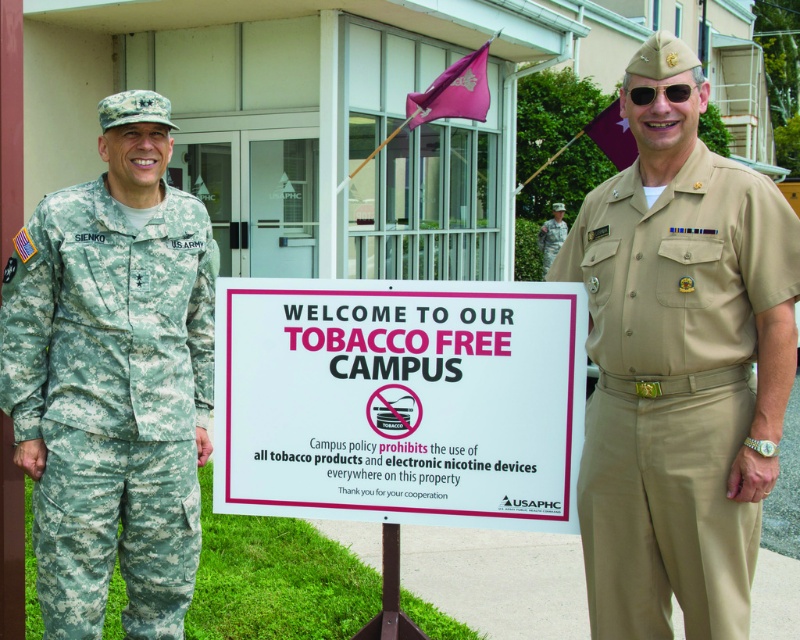
Does white paper sign at center appear on the left side of camouflage fabric uniform at left?

In fact, white paper sign at center is to the right of camouflage fabric uniform at left.

In the scene shown: Does white paper sign at center have a greater width compared to camouflage fabric uniform at left?

Correct, the width of white paper sign at center exceeds that of camouflage fabric uniform at left.

This screenshot has height=640, width=800. Describe the element at coordinates (400, 401) in the screenshot. I see `white paper sign at center` at that location.

The width and height of the screenshot is (800, 640). In order to click on white paper sign at center in this screenshot , I will do `click(400, 401)`.

Which is more to the right, camouflage fabric uniform at left or camouflage fabric uniform at center?

From the viewer's perspective, camouflage fabric uniform at center appears more on the right side.

Can you confirm if camouflage fabric uniform at left is positioned below camouflage fabric uniform at center?

Correct, camouflage fabric uniform at left is located below camouflage fabric uniform at center.

Image resolution: width=800 pixels, height=640 pixels. What are the coordinates of `camouflage fabric uniform at left` in the screenshot? It's located at (112, 400).

Can you confirm if white paper sign at center is positioned to the left of camouflage fabric uniform at center?

Correct, you'll find white paper sign at center to the left of camouflage fabric uniform at center.

Is white paper sign at center shorter than camouflage fabric uniform at center?

Correct, white paper sign at center is not as tall as camouflage fabric uniform at center.

Identify the location of white paper sign at center. The height and width of the screenshot is (640, 800). (400, 401).

In order to click on white paper sign at center in this screenshot , I will do `click(400, 401)`.